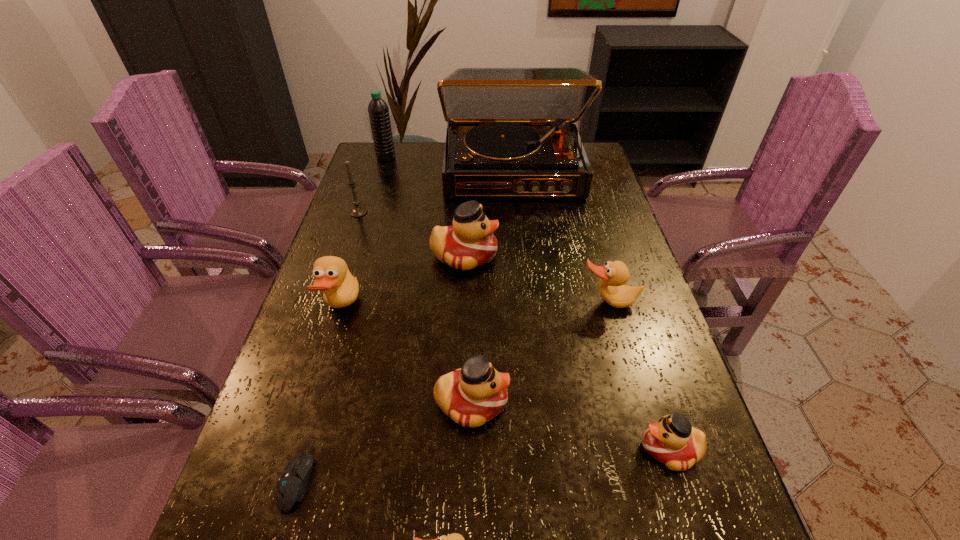
Find the location of `blank space located on the face of the rightmost red duck`. blank space located on the face of the rightmost red duck is located at coordinates (574, 449).

At what (x,y) coordinates should I click in order to perform the action: click on vacant area situated 0.110m on the face of the rightmost red duck. Please return your answer as a coordinate pair (x, y). The image size is (960, 540). Looking at the image, I should click on (579, 449).

Where is `vacant space located 0.160m on the face of the rightmost red duck`? The width and height of the screenshot is (960, 540). vacant space located 0.160m on the face of the rightmost red duck is located at coordinates (552, 449).

Image resolution: width=960 pixels, height=540 pixels. Find the location of `vacant space located 0.170m on the back of the shortest object`. vacant space located 0.170m on the back of the shortest object is located at coordinates (329, 368).

Image resolution: width=960 pixels, height=540 pixels. In order to click on record player that is at the far edge in this screenshot , I will do `click(511, 133)`.

Find the location of `water bottle positioned at the far edge`. water bottle positioned at the far edge is located at coordinates (378, 110).

Image resolution: width=960 pixels, height=540 pixels. Find the location of `water bottle at the left edge`. water bottle at the left edge is located at coordinates (x=378, y=110).

Where is `candle that is at the left edge`? Image resolution: width=960 pixels, height=540 pixels. candle that is at the left edge is located at coordinates (358, 211).

The height and width of the screenshot is (540, 960). Identify the location of duck situated at the left edge. (340, 288).

The width and height of the screenshot is (960, 540). I want to click on computer mouse present at the left edge, so click(x=291, y=487).